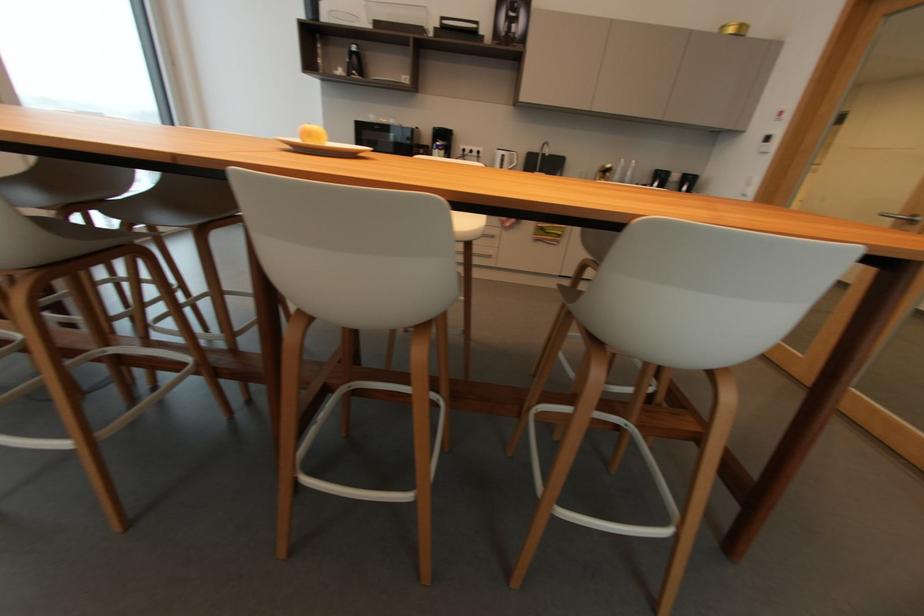
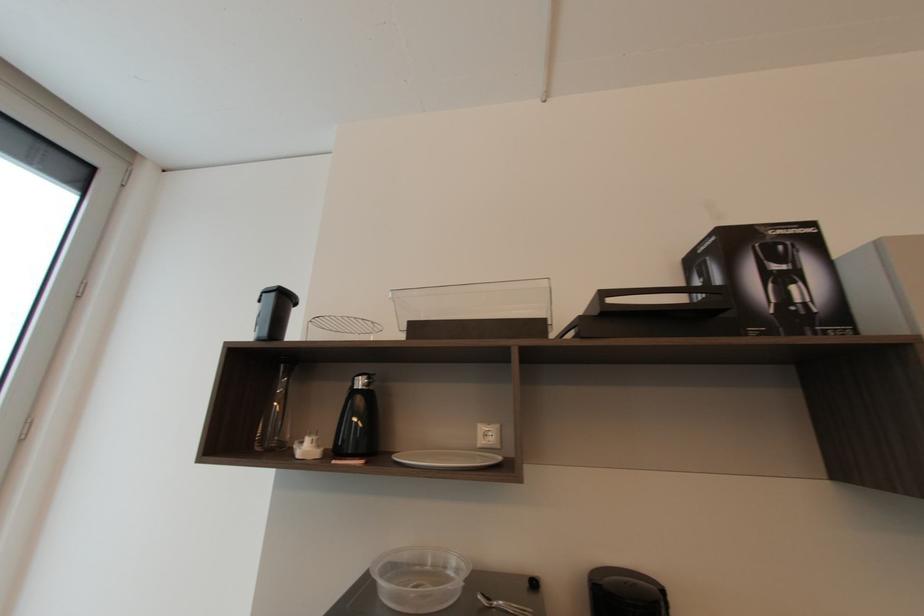
In the second image, find the point that corresponds to the point at 358,49 in the first image.

(362, 384)